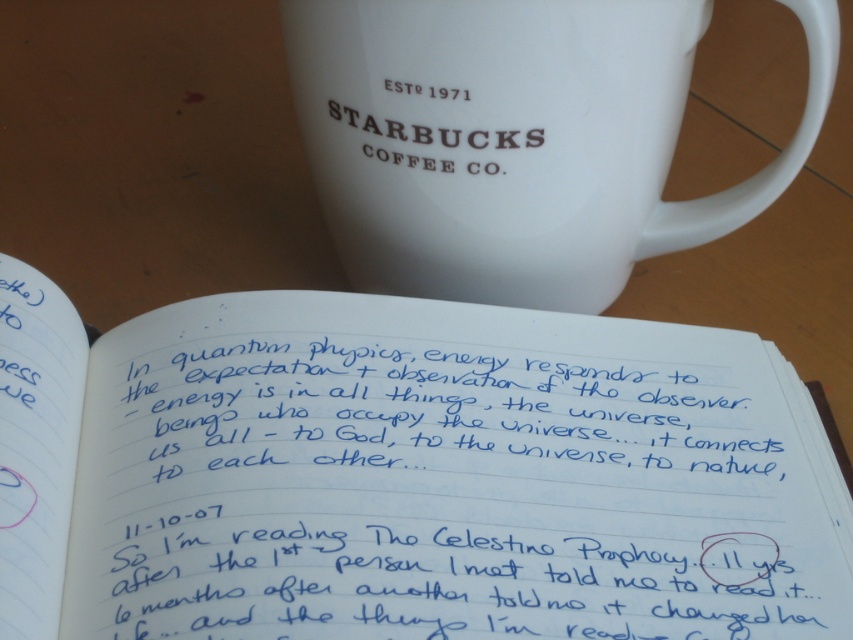
You are looking at the image and see two points marked on the screen. The first point is at coordinate point (431, 614) and the second is at coordinate point (553, 12). Which point is closer to you?

Point (431, 614) is in front of point (553, 12), so the first point is closer to you.

You are an office worker who needs to place a new sticky note on the white Starbucks coffee mug. According to the image, where should you place the sticky note so that it is closest to the point labeled as point [405,474]?

The point [405,474] indicates the white paper notebook at upper center. To place the sticky note closest to this point, you should place it on the side of the white Starbucks coffee mug nearest to the white paper notebook at upper center.

You are a barista working at Starbucks. You need to place a new coffee order on the counter. The new coffee cup is 4 inches wide. There is a space between the white paper notebook at upper center and the white ceramic mug at upper center. Can the new coffee cup fit in that space?

The distance between the white paper notebook at upper center and the white ceramic mug at upper center is 9.55 inches. Since the new coffee cup is only 4 inches wide, it can fit in the space between them.